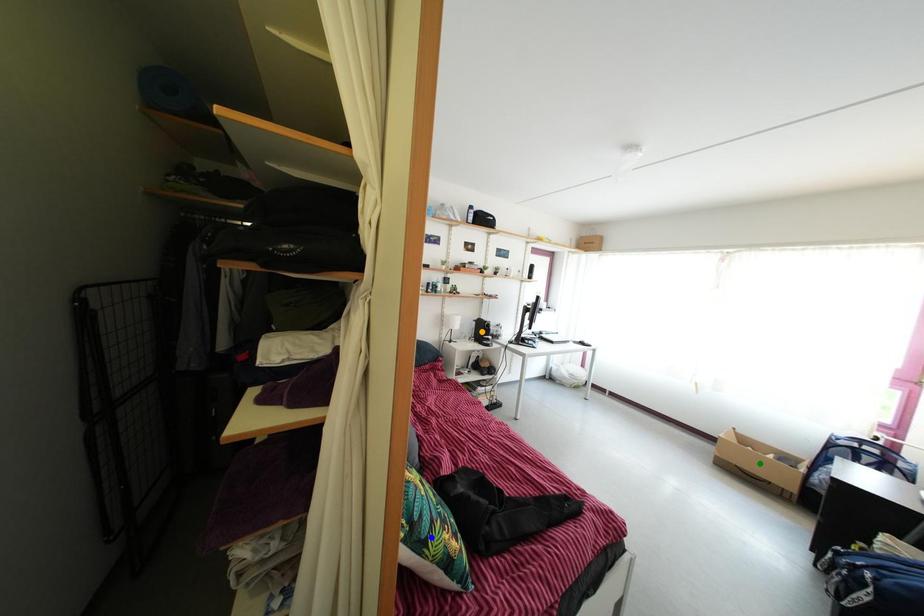
Order these from nearest to farthest:
green point, orange point, blue point

1. orange point
2. green point
3. blue point